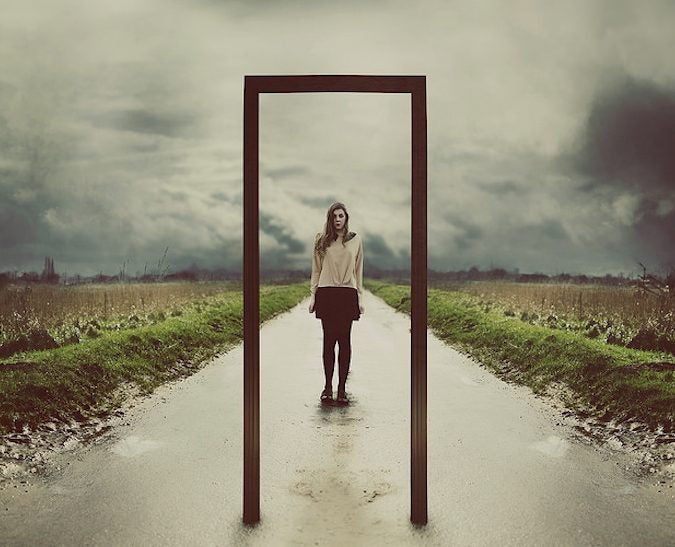
Where is `open brown door frame`? The image size is (675, 547). open brown door frame is located at coordinates (320, 90), (423, 259), (252, 312).